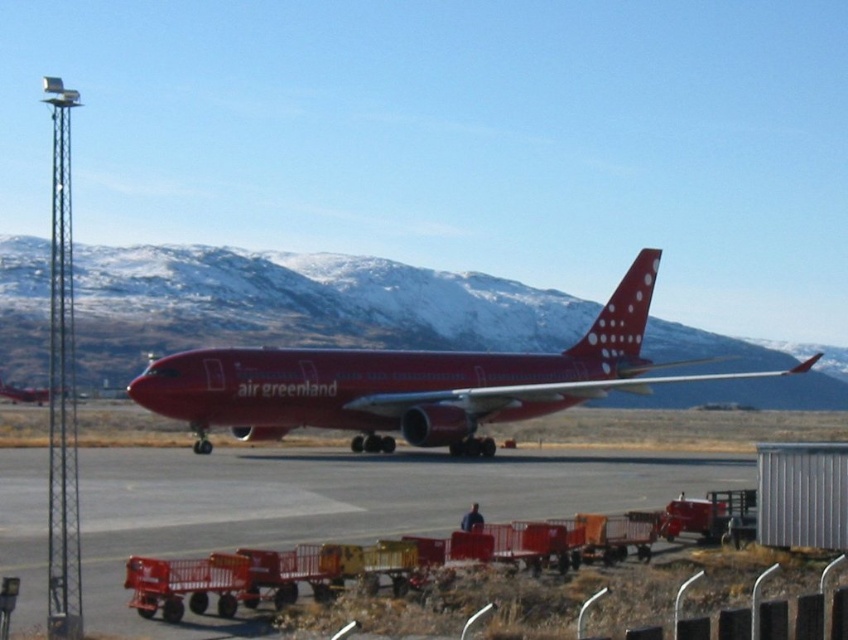
Question: Is metallic gray tarmac at center positioned behind polished red airplane at center?

Choices:
 (A) yes
 (B) no

Answer: (B)

Question: Is metallic gray tarmac at center thinner than polished red airplane at center?

Choices:
 (A) no
 (B) yes

Answer: (B)

Question: Which point is closer to the camera taking this photo?

Choices:
 (A) (247, 360)
 (B) (328, 518)

Answer: (B)

Question: Does metallic gray tarmac at center lie behind polished red airplane at center?

Choices:
 (A) yes
 (B) no

Answer: (B)